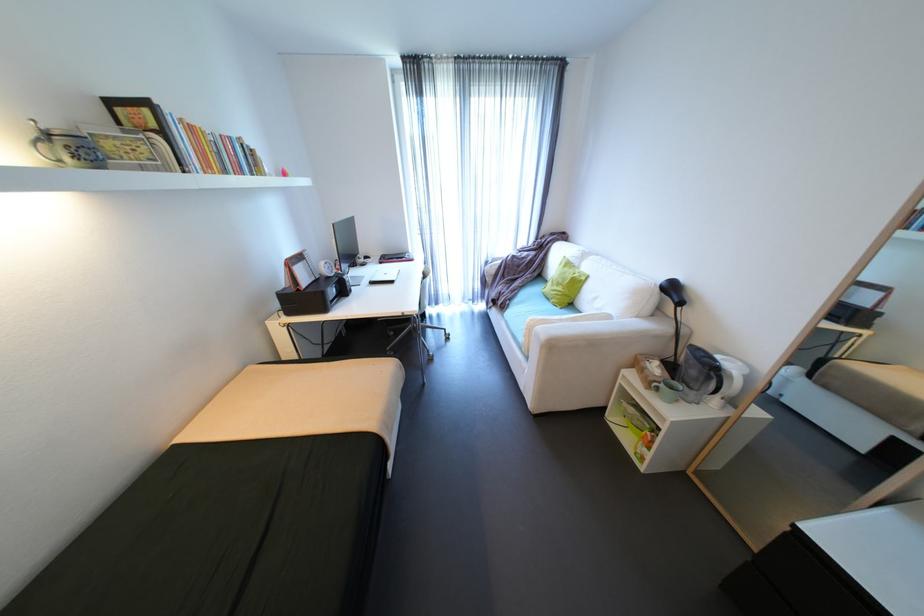
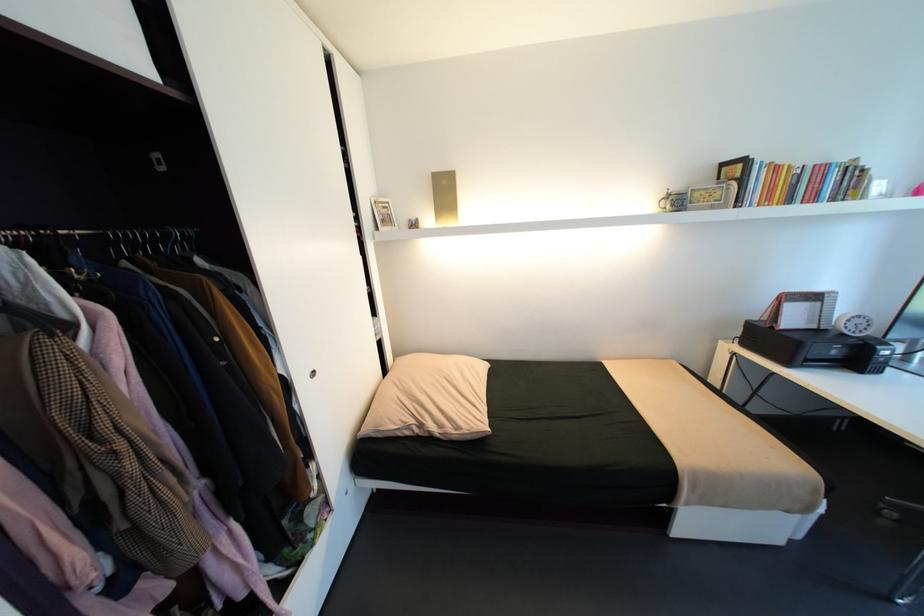
Find the pixel in the second image that matches [50,128] in the first image.

(676, 192)